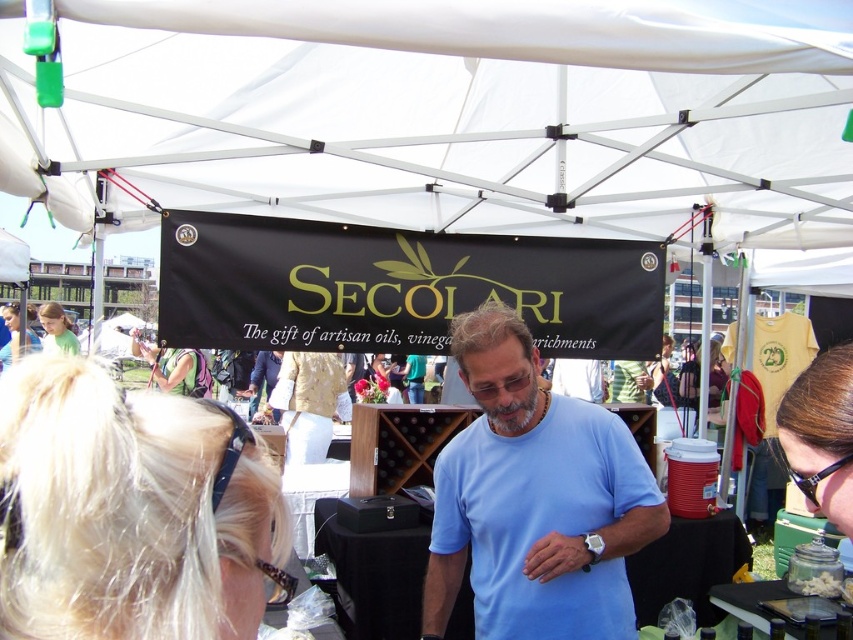
You are standing at the entrance of the market tent and want to take a photo. You notice two points marked in the scene. Which point is closer to you, point (4,406) or point (541,634)?

Point (4,406) is closer to the viewer than point (541,634).

You are standing at the center of the market tent and want to locate the blonde hair at upper left. Which direction should you turn to face the point at point [129,509]?

The point at [129,509] is on the blonde hair at upper left, so you should turn to face the upper left direction to locate it.